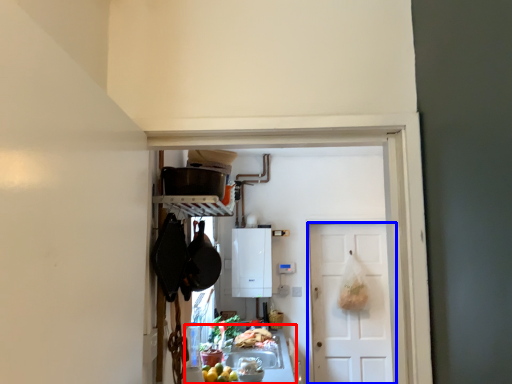
Question: Which point is closer to the camera, counter top (highlighted by a red box) or door (highlighted by a blue box)?

Choices:
 (A) counter top
 (B) door

Answer: (A)